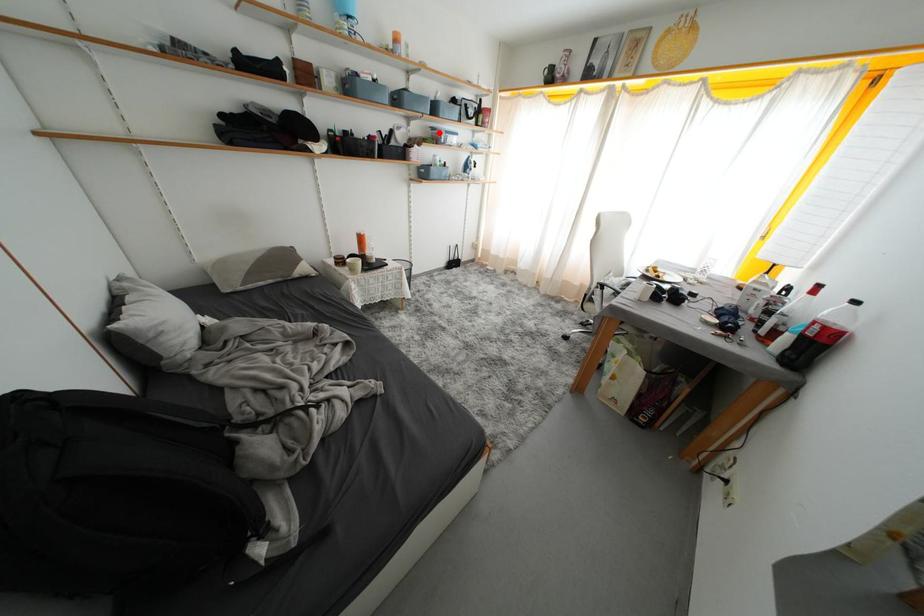
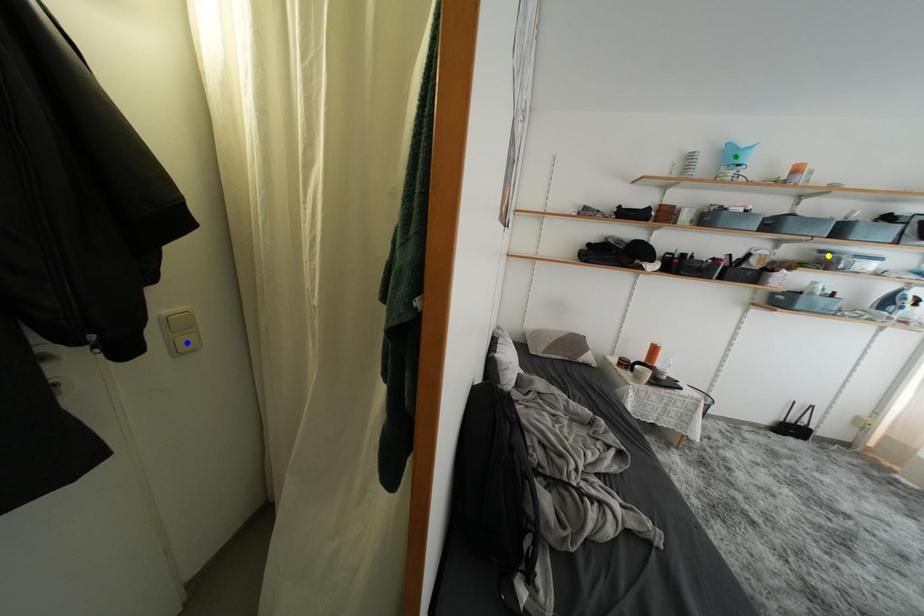
Question: I am providing you with two images of the same scene from different viewpoints. A red point is marked on the first image. You are given multiple points on the second image. Can you choose the point in image 2 that corresponds to the point in image 1?

Choices:
 (A) yellow point
 (B) green point
 (C) blue point

Answer: (A)